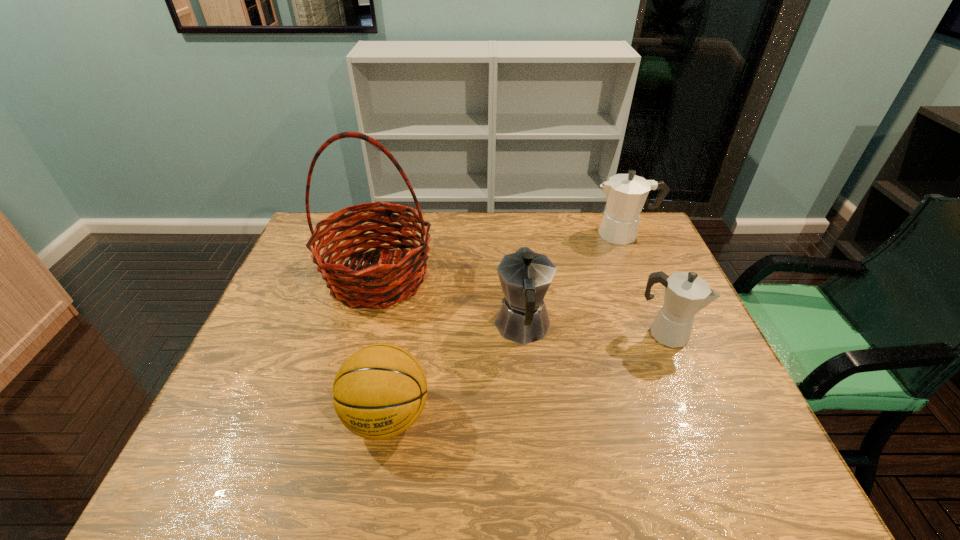
This screenshot has width=960, height=540. I want to click on the tallest object, so click(x=397, y=280).

You are a GUI agent. You are given a task and a screenshot of the screen. Output one action in this format:
    pyautogui.click(x=<x>, y=<y>)
    Task: Click on the farthest coffeepot
    Image resolution: width=960 pixels, height=540 pixels.
    Given the screenshot: What is the action you would take?
    [626, 194]

Identify the location of the leftmost coffeepot. This screenshot has width=960, height=540. (525, 276).

The height and width of the screenshot is (540, 960). Find the location of `basketball`. basketball is located at coordinates (379, 392).

Locate an element on the screen. The width and height of the screenshot is (960, 540). vacant area located on the back of the tallest object is located at coordinates (393, 222).

Locate an element on the screen. The height and width of the screenshot is (540, 960). vacant space located at the spout of the farthest coffeepot is located at coordinates (565, 234).

The height and width of the screenshot is (540, 960). I want to click on vacant region located at the spout of the farthest coffeepot, so click(x=497, y=234).

I want to click on free space located at the spout of the farthest coffeepot, so click(517, 234).

Where is `free space located 0.110m at the spout of the third object from right to left`? Image resolution: width=960 pixels, height=540 pixels. free space located 0.110m at the spout of the third object from right to left is located at coordinates (517, 275).

Where is `free space located 0.140m at the spout of the third object from right to left`? This screenshot has height=540, width=960. free space located 0.140m at the spout of the third object from right to left is located at coordinates (516, 269).